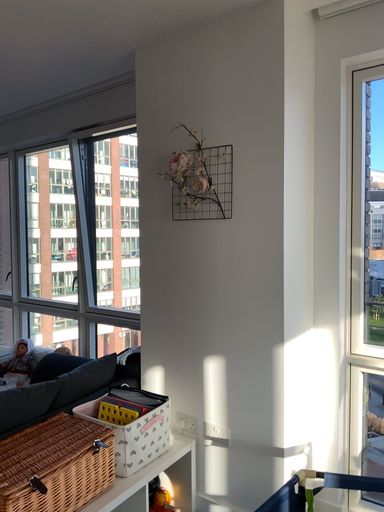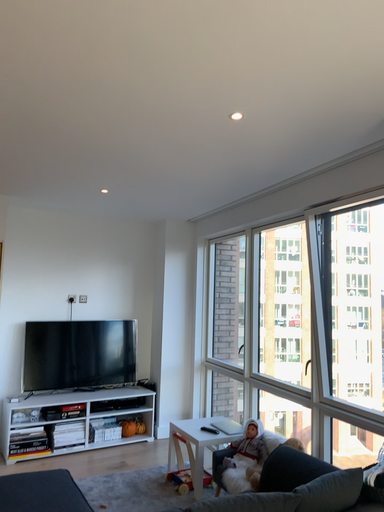
Question: How did the camera likely rotate when shooting the video?

Choices:
 (A) rotated downward
 (B) rotated upward

Answer: (B)